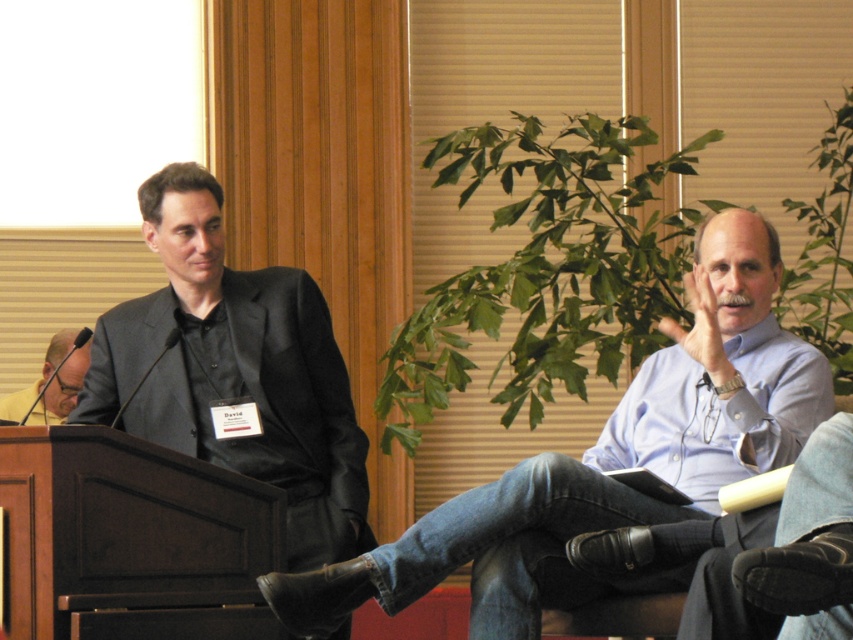
Question: Does blue shirt at right appear under dark gray suit at left?

Choices:
 (A) no
 (B) yes

Answer: (B)

Question: Which point is closer to the camera taking this photo?

Choices:
 (A) (77, 392)
 (B) (375, 548)

Answer: (B)

Question: Among these points, which one is farthest from the camera?

Choices:
 (A) (68, 337)
 (B) (184, 394)

Answer: (A)

Question: In this image, where is blue shirt at right located relative to dark gray suit at left?

Choices:
 (A) above
 (B) below

Answer: (B)

Question: Estimate the real-world distances between objects in this image. Which object is closer to the matte black suit at left?

Choices:
 (A) dark gray suit at left
 (B) blue shirt at right

Answer: (A)

Question: Is the position of blue shirt at right more distant than that of dark gray suit at left?

Choices:
 (A) no
 (B) yes

Answer: (A)